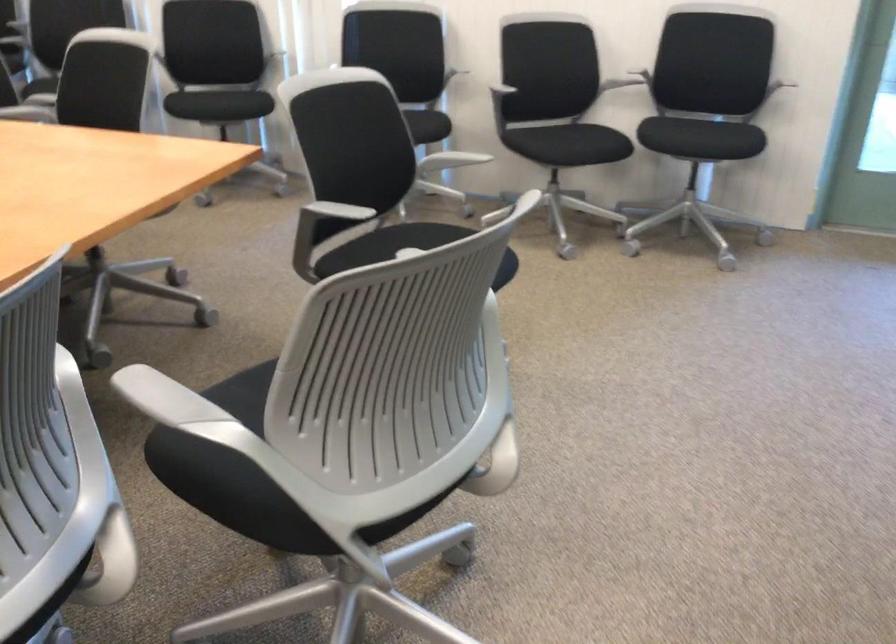
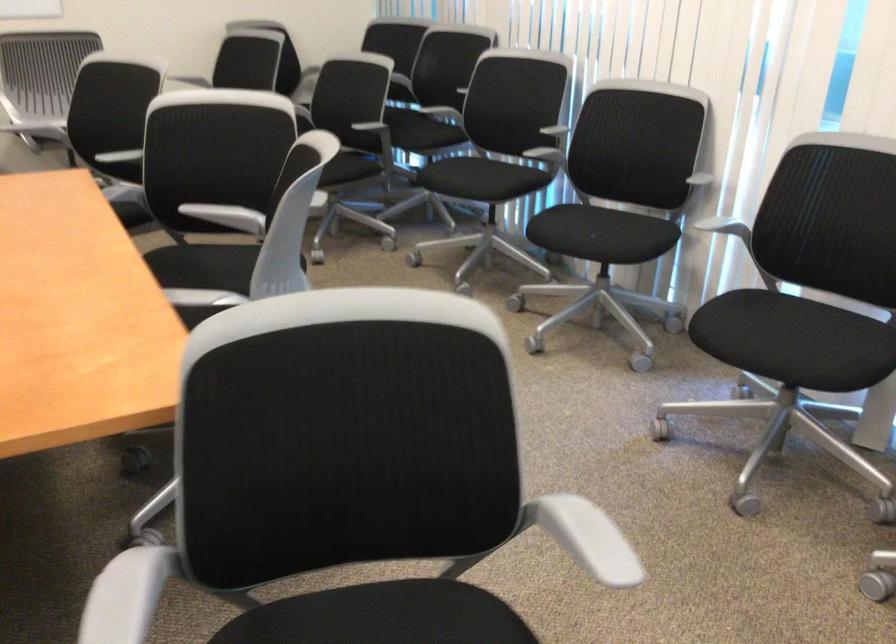
Locate, in the second image, the point that corresponds to (218,95) in the first image.

(582, 232)